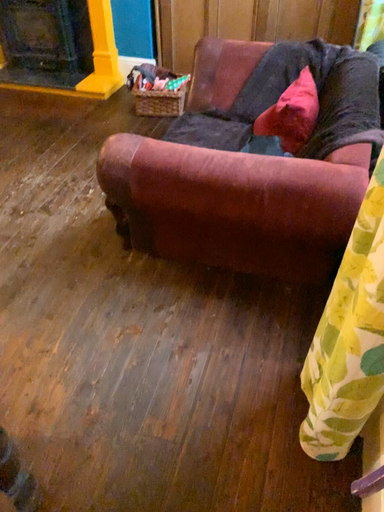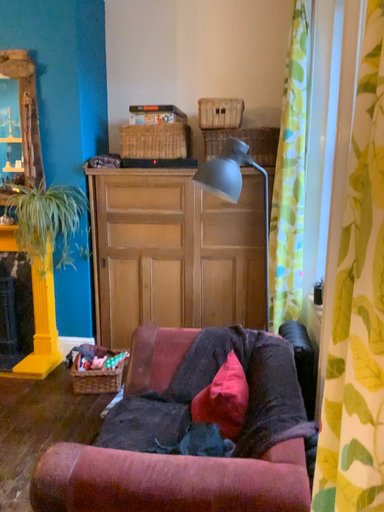
Question: Which way did the camera rotate in the video?

Choices:
 (A) rotated upward
 (B) rotated downward

Answer: (A)